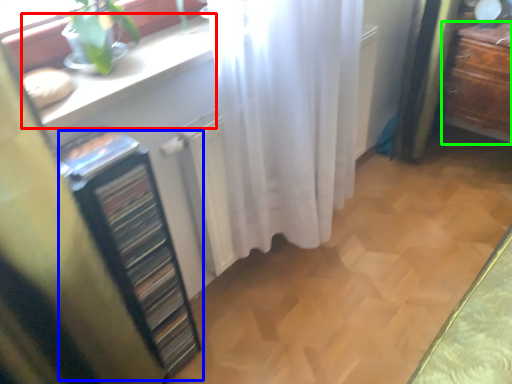
Question: Based on their relative distances, which object is farther from counter top (highlighted by a red box)? Choose from file cabinet (highlighted by a blue box) and furniture (highlighted by a green box).

Choices:
 (A) file cabinet
 (B) furniture

Answer: (B)